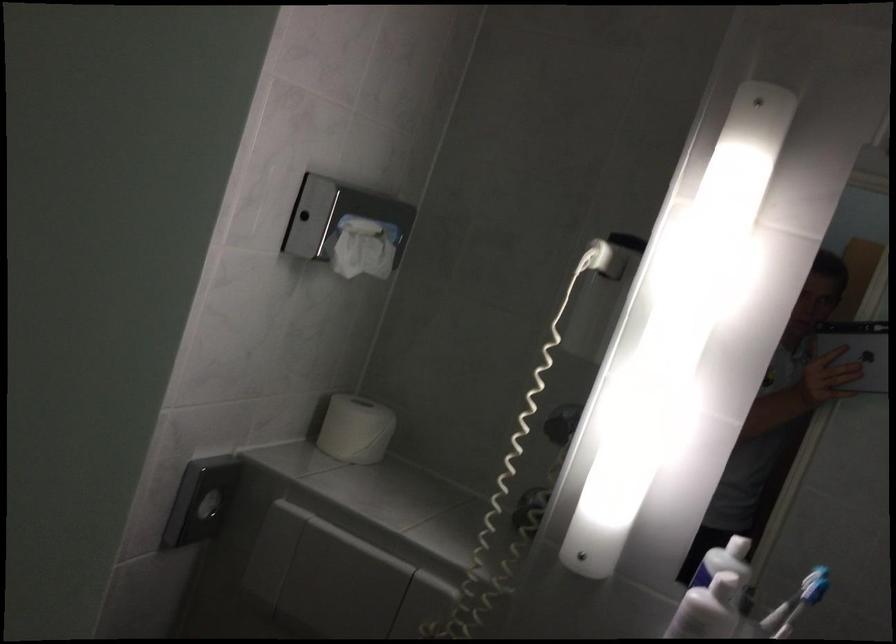
The location [858,351] corresponds to which object?

It refers to a silver tablet.